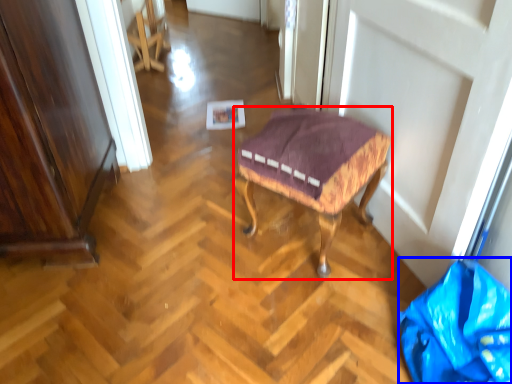
Question: Which object is further to the camera taking this photo, stool (highlighted by a red box) or material (highlighted by a blue box)?

Choices:
 (A) stool
 (B) material

Answer: (A)